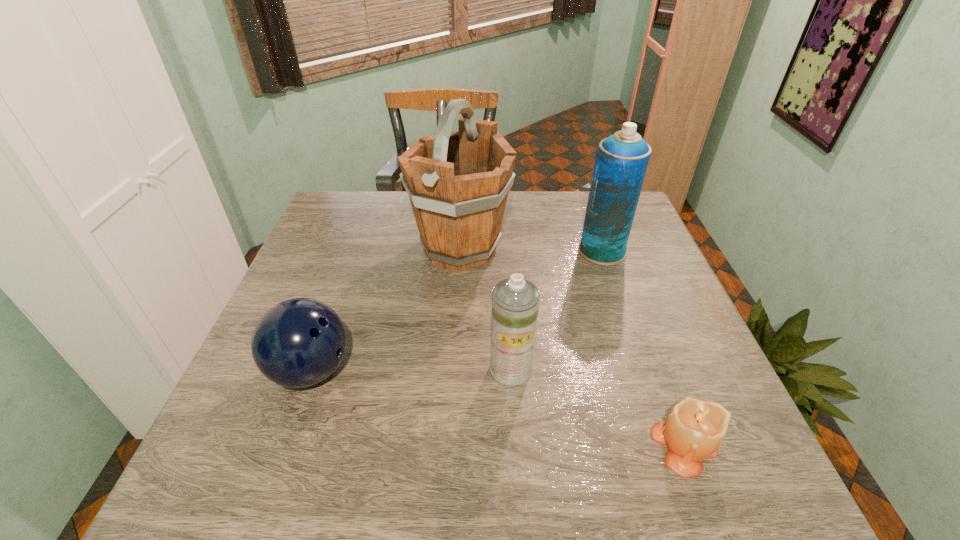
The height and width of the screenshot is (540, 960). Identify the location of free space at the far edge of the desktop. (506, 217).

In the image, there is a desktop. Where is `vacant area at the left edge`? This screenshot has width=960, height=540. vacant area at the left edge is located at coordinates [231, 420].

Identify the location of vacant space at the right edge of the desktop. The width and height of the screenshot is (960, 540). [x=642, y=284].

In the image, there is a desktop. Identify the location of free space at the near left corner. pos(182,494).

Locate an element on the screen. vacant area that lies between the bucket and the shortest object is located at coordinates (572, 346).

You are a GUI agent. You are given a task and a screenshot of the screen. Output one action in this format:
    pyautogui.click(x=<x>, y=<y>)
    Task: Click on the free space between the bowling ball and the nearest object
    Image resolution: width=960 pixels, height=540 pixels.
    Given the screenshot: What is the action you would take?
    pyautogui.click(x=497, y=407)

Locate an element on the screen. empty location between the bowling ball and the taller aerosol can is located at coordinates (457, 310).

Identify the location of free spot between the left aerosol can and the candle. The image size is (960, 540). (597, 407).

Image resolution: width=960 pixels, height=540 pixels. I want to click on vacant area between the bucket and the nearer aerosol can, so click(486, 308).

Identify the location of free space between the bowling ball and the shorter aerosol can. The image size is (960, 540). (411, 369).